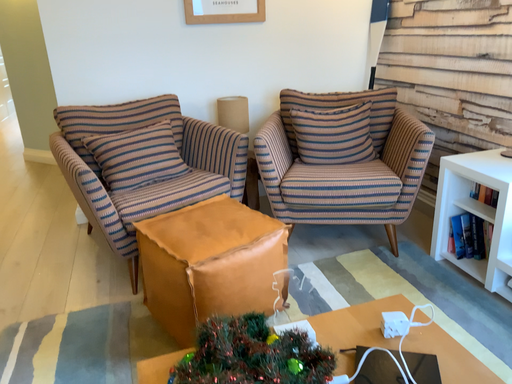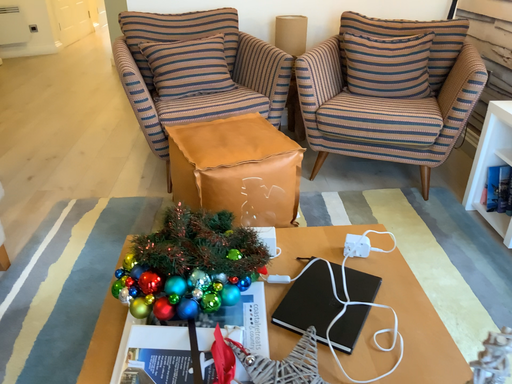
Question: How did the camera likely rotate when shooting the video?

Choices:
 (A) rotated upward
 (B) rotated downward

Answer: (B)